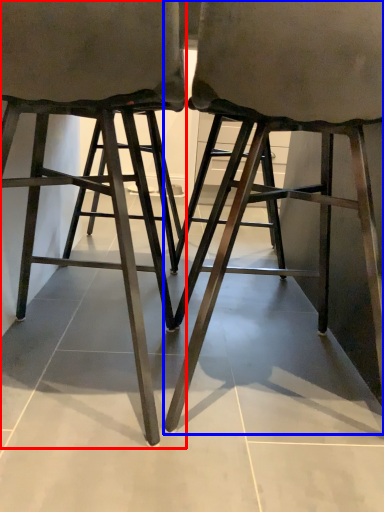
Question: Which point is closer to the camera, stool (highlighted by a red box) or stool (highlighted by a blue box)?

Choices:
 (A) stool
 (B) stool

Answer: (A)